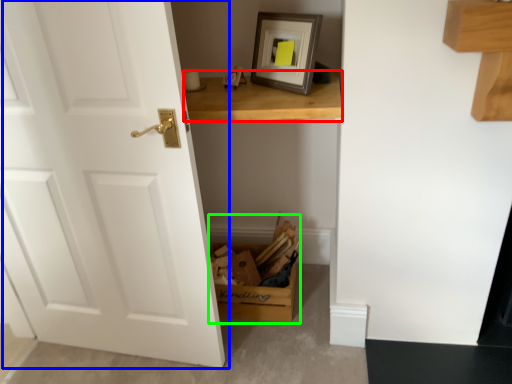
Question: Which object is positioned farthest from table (highlighted by a red box)? Select from door (highlighted by a blue box) and cardboard box (highlighted by a green box).

Choices:
 (A) door
 (B) cardboard box

Answer: (B)